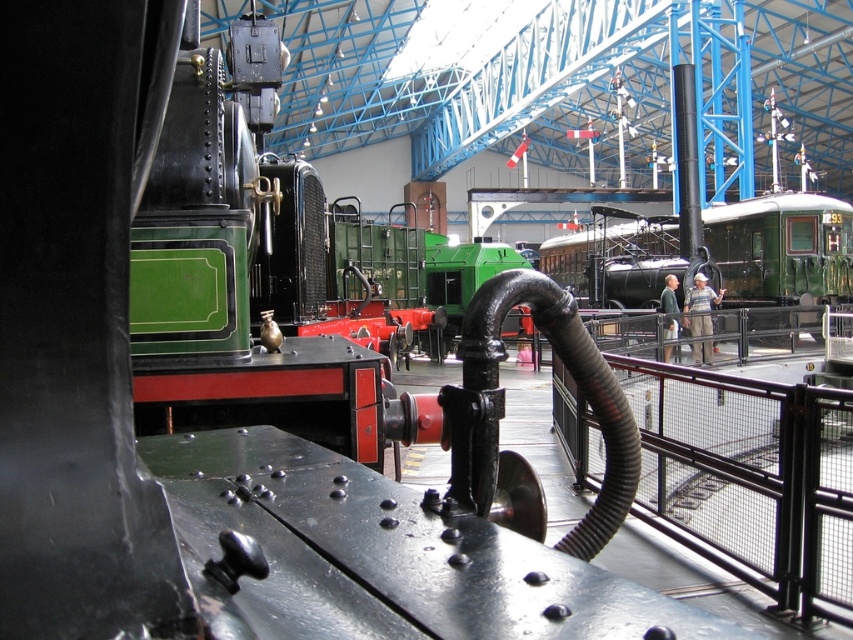
Can you confirm if black metal rail at center is positioned to the right of green polished wood train at center?

Incorrect, black metal rail at center is not on the right side of green polished wood train at center.

Is point (796, 570) positioned before point (643, 262)?

Yes, point (796, 570) is in front of point (643, 262).

Between point (697, 516) and point (758, 237), which one is positioned behind?

The point (758, 237) is behind.

The width and height of the screenshot is (853, 640). What are the coordinates of `black metal rail at center` in the screenshot? It's located at (749, 477).